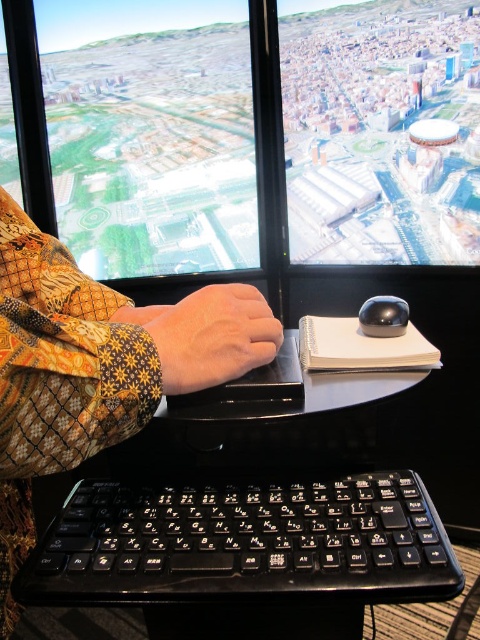
Does black plastic keyboard at lower center have a lesser height compared to leather-like hand at center?

Indeed, black plastic keyboard at lower center has a lesser height compared to leather-like hand at center.

Does black plastic keyboard at lower center have a greater width compared to leather-like hand at center?

Correct, the width of black plastic keyboard at lower center exceeds that of leather-like hand at center.

Where is `black plastic keyboard at lower center`? Image resolution: width=480 pixels, height=640 pixels. black plastic keyboard at lower center is located at coordinates (243, 541).

Who is higher up, black plastic keyboard at lower center or patterned fabric sleeve at center?

Positioned higher is patterned fabric sleeve at center.

Based on the photo, is black plastic keyboard at lower center positioned behind patterned fabric sleeve at center?

That is True.

Who is more distant from viewer, (163, 541) or (9, 195)?

The point (9, 195) is more distant.

Where is `black plastic keyboard at lower center`? black plastic keyboard at lower center is located at coordinates (243, 541).

Does patterned fabric sleeve at center lie in front of leather-like hand at center?

Yes, patterned fabric sleeve at center is in front of leather-like hand at center.

In the scene shown: Is patterned fabric sleeve at center taller than leather-like hand at center?

Yes.

Is point (25, 378) positioned after point (229, 284)?

No.

At what (x,y) coordinates should I click in order to perform the action: click on patterned fabric sleeve at center. Please return your answer as a coordinate pair (x, y). Image resolution: width=480 pixels, height=640 pixels. Looking at the image, I should click on (95, 368).